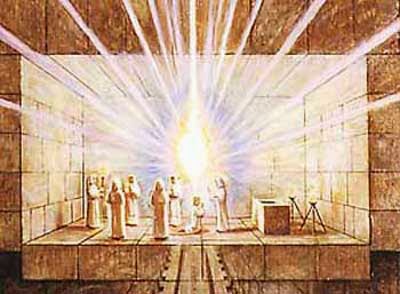
Identify the location of stands. This screenshot has width=400, height=294. (312, 201).